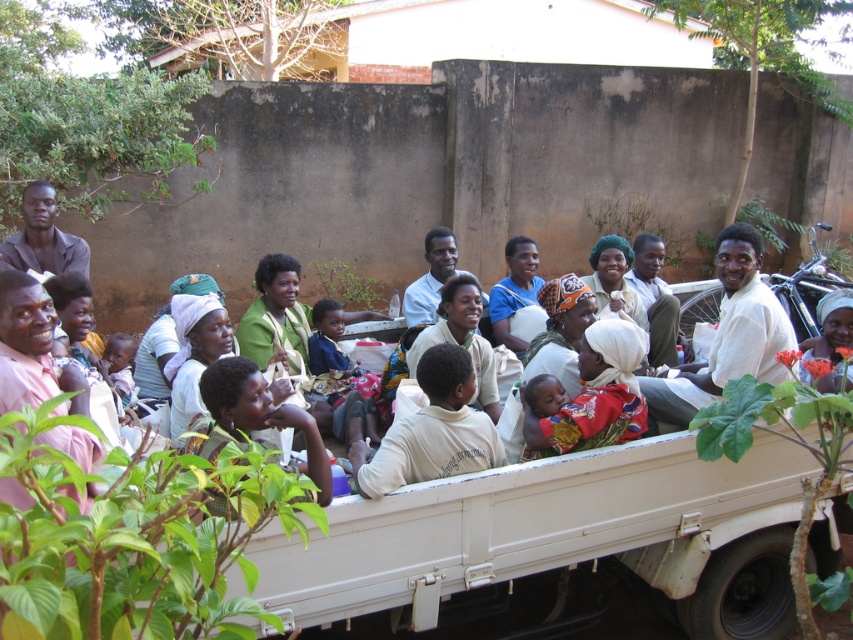
Question: Which point is farther from the camera taking this photo?

Choices:
 (A) (21, 230)
 (B) (436, 266)
 (C) (28, 348)

Answer: (B)

Question: Does white matte shirt at center appear under light brown skin at center?

Choices:
 (A) yes
 (B) no

Answer: (A)

Question: Where is white matte shirt at center located in relation to pink matte shirt at left in the image?

Choices:
 (A) below
 (B) above

Answer: (B)

Question: Which object is closer to the camera taking this photo?

Choices:
 (A) light brown skin at center
 (B) pink matte shirt at left
 (C) matte brown shirt at left

Answer: (B)

Question: Can you confirm if white matte shirt at center is smaller than matte brown shirt at left?

Choices:
 (A) yes
 (B) no

Answer: (B)

Question: Which point is closer to the camera taking this photo?

Choices:
 (A) (727, 369)
 (B) (67, 490)
 (C) (42, 209)

Answer: (B)